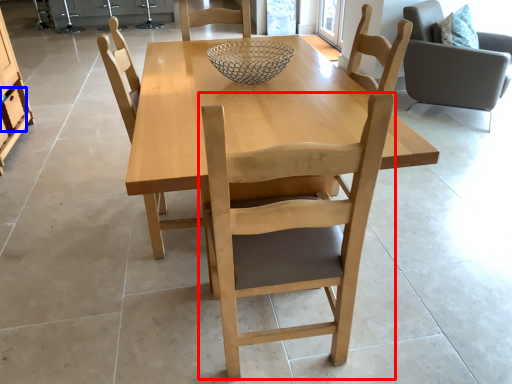
Question: Which point is closer to the camera, chair (highlighted by a red box) or drawer (highlighted by a blue box)?

Choices:
 (A) chair
 (B) drawer

Answer: (A)